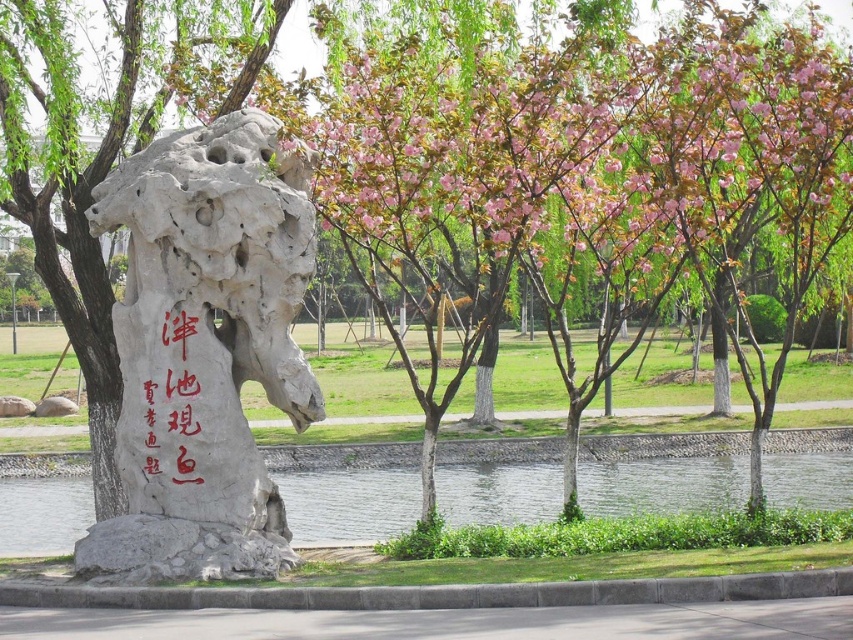
You are standing in the park and see the clear water at center and the red calligraphy stone at center. Which object is located to the right side of the other?

The clear water at center is to the right of the red calligraphy stone at center, so the clear water at center is located to the right of the red calligraphy stone at center.

You are standing in the park and want to find the natural stone rock at center. According to the coordinates provided, where should you look?

The natural stone rock at center is located at coordinates point [204,349].